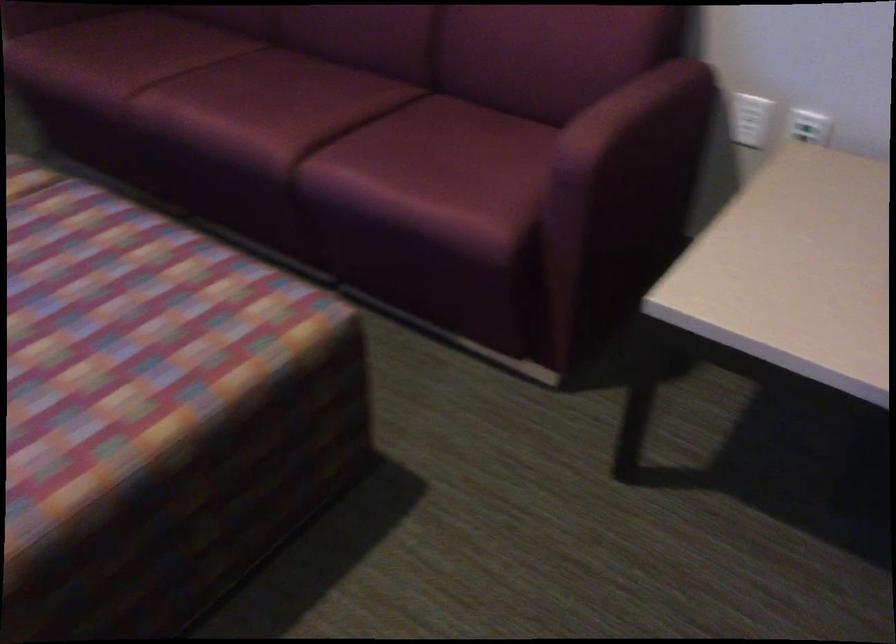
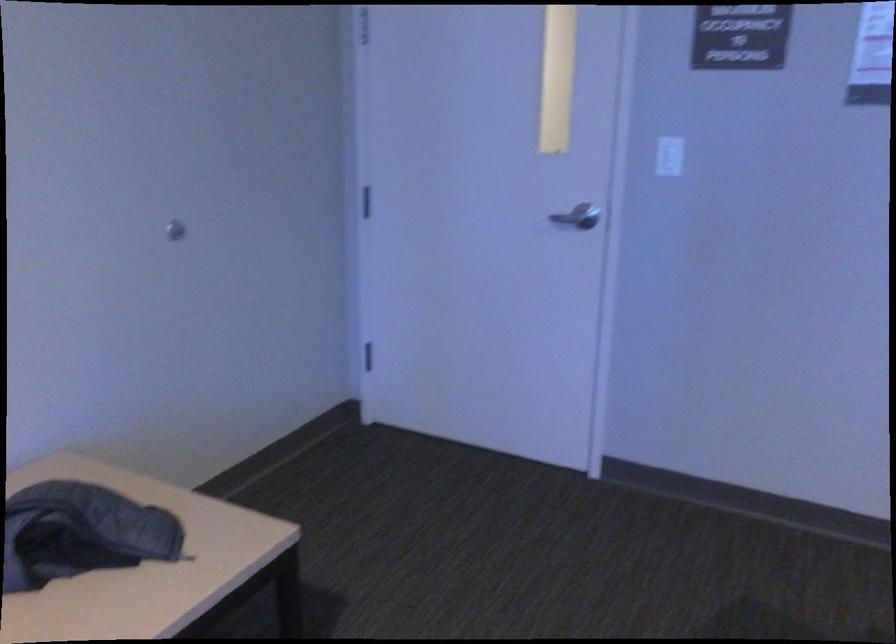
How did the camera likely rotate?

The rotation direction of the camera is right-down.